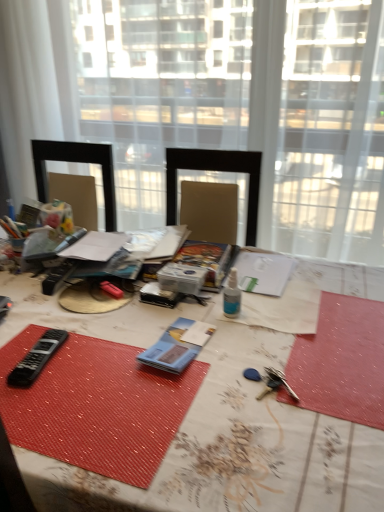
Locate an element on the screen. This screenshot has width=384, height=512. vacant region to the left of blue paper at center, the first equipment when ordered from right to left is located at coordinates (105, 347).